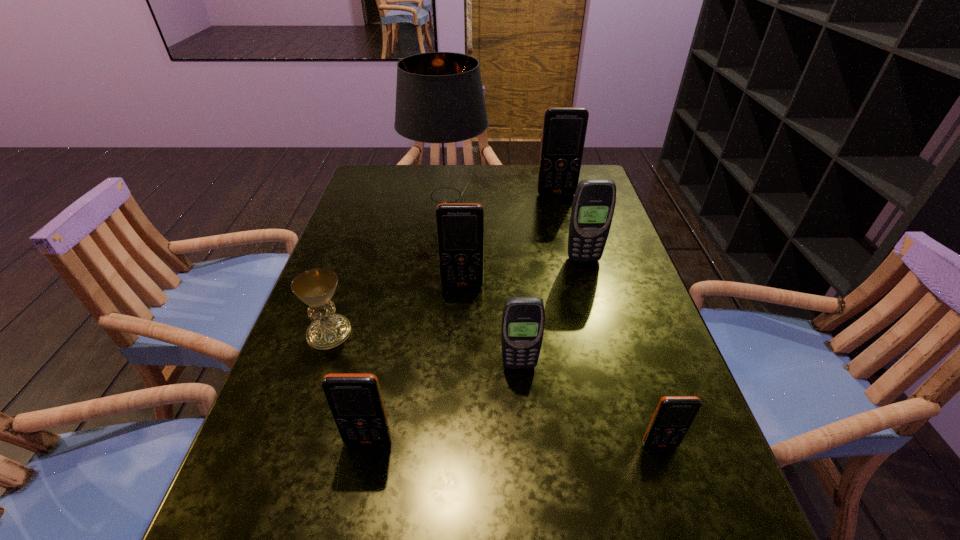
The width and height of the screenshot is (960, 540). I want to click on vacant space at the left edge, so [x=352, y=348].

You are a GUI agent. You are given a task and a screenshot of the screen. Output one action in this format:
    pyautogui.click(x=<x>, y=<y>)
    Task: Click on the vacant space at the right edge of the desktop
    This screenshot has height=540, width=960.
    Given the screenshot: What is the action you would take?
    pyautogui.click(x=570, y=260)

Identify the location of vacant area that lies between the shortest cellular telephone and the fourth nearest object. (494, 389).

Identify the location of free space that is in between the third biggest orange cellular telephone and the smallest orange cellular telephone. (514, 443).

Identify the location of vacant region between the nearer gray cellular telephone and the tallest cellular telephone. The image size is (960, 540). (538, 280).

Locate an element on the screen. Image resolution: width=960 pixels, height=540 pixels. empty space between the chalice and the smallest orange cellular telephone is located at coordinates (494, 389).

Identify the location of free point between the farthest cellular telephone and the left gray cellular telephone. (538, 280).

The width and height of the screenshot is (960, 540). I want to click on vacant space that's between the sixth farthest object and the second smallest orange cellular telephone, so click(444, 403).

At what (x,y) coordinates should I click in order to perform the action: click on free point between the tallest object and the smallest orange cellular telephone. Please return your answer as a coordinate pair (x, y). The width and height of the screenshot is (960, 540). Looking at the image, I should click on (553, 320).

Where is `the fourth closest object to the gray lampshade`? Image resolution: width=960 pixels, height=540 pixels. the fourth closest object to the gray lampshade is located at coordinates (316, 287).